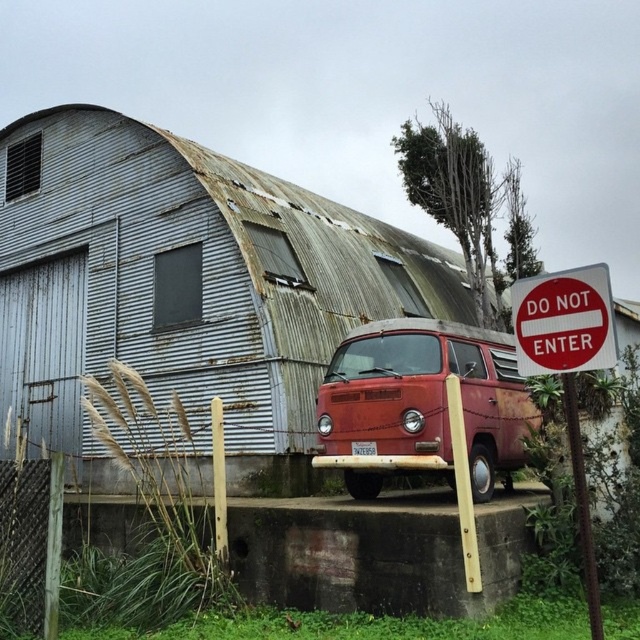
You are driving a delivery truck that is 20 feet long and need to park it between the rusty corrugated metal barn at center and the red plastic sign at right. Can the truck fit in the space between them?

The distance between the rusty corrugated metal barn at center and the red plastic sign at right is 25.37 feet. Since the truck is 20 feet long, it can fit in the space between them as there is enough room.

You are a delivery driver who needs to park your truck, which is 2 meters tall, in a parking spot near the rusty metal van at center. Based on the scene, will your truck fit under the red plastic sign at right without hitting it?

The rusty metal van at center is taller than the red plastic sign at right. Since your truck is 2 meters tall and the sign is shorter than the van, there is a risk that your truck might hit the sign when parking. Check the height clearance before proceeding.

You are driving a car and see the red plastic sign at right and the red plastic sign at upper right. Which one is closer to you?

The red plastic sign at right is closer to you because the red plastic sign at upper right is behind it.